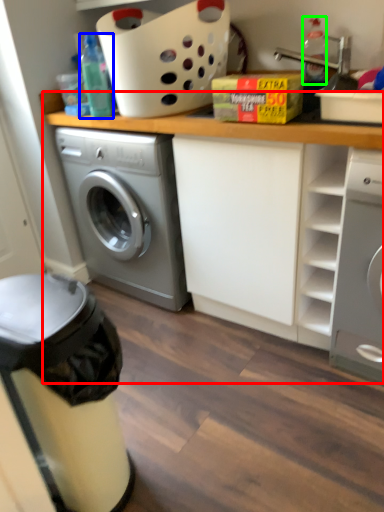
Question: Estimate the real-world distances between objects in this image. Which object is farther from counter top (highlighted by a red box), bottle (highlighted by a blue box) or bottle (highlighted by a green box)?

Choices:
 (A) bottle
 (B) bottle

Answer: (B)